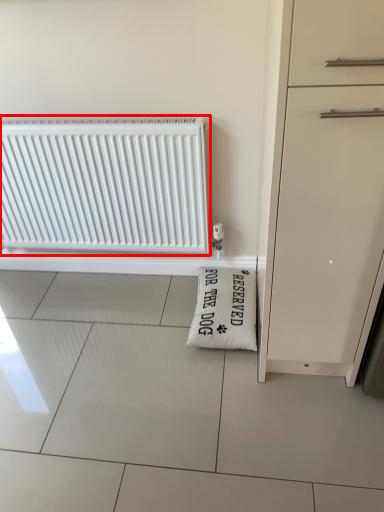
Question: From the image's perspective, where is radiator (annotated by the red box) located relative to doormat?

Choices:
 (A) below
 (B) above

Answer: (B)